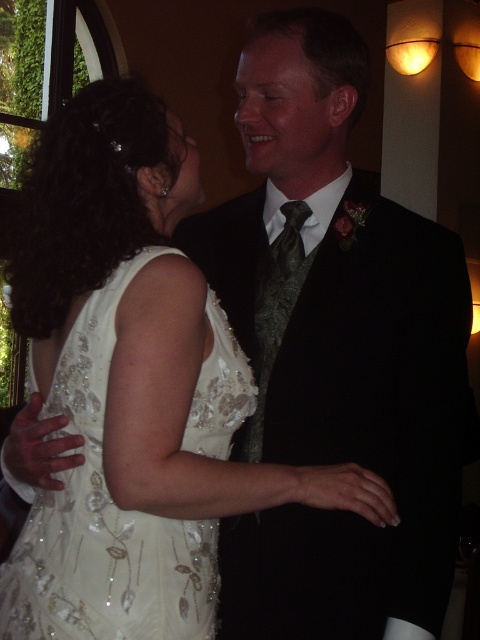
Question: Is black satin suit at center above white sequined dress at center?

Choices:
 (A) no
 (B) yes

Answer: (B)

Question: Estimate the real-world distances between objects in this image. Which object is farther from the black satin suit at center?

Choices:
 (A) white sequined dress at center
 (B) sequined satin dress at center

Answer: (B)

Question: Can you confirm if black satin suit at center is wider than green satin tie at center?

Choices:
 (A) yes
 (B) no

Answer: (A)

Question: Is white sequined dress at center above sequined satin dress at center?

Choices:
 (A) yes
 (B) no

Answer: (A)

Question: Which point is farther to the camera?

Choices:
 (A) coord(47,186)
 (B) coord(67,504)

Answer: (A)

Question: Among these objects, which one is farthest from the camera?

Choices:
 (A) sequined satin dress at center
 (B) black satin suit at center
 (C) white sequined dress at center
 (D) green satin tie at center

Answer: (D)